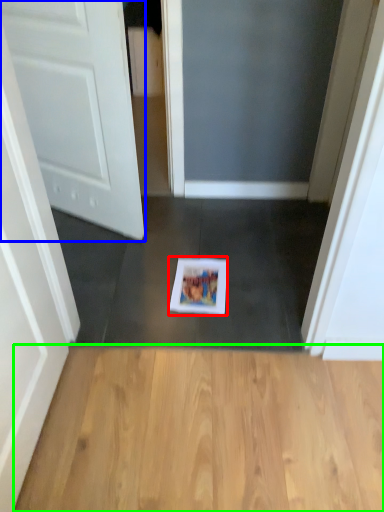
Question: Considering the real-world distances, which object is farthest from copy (highlighted by a red box)? door (highlighted by a blue box) or hardwood (highlighted by a green box)?

Choices:
 (A) door
 (B) hardwood

Answer: (A)